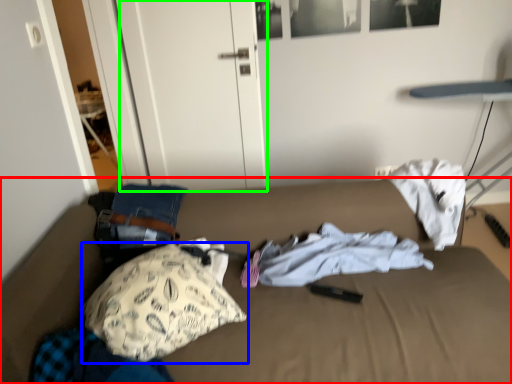
Question: Considering the real-world distances, which object is closest to bed (highlighted by a red box)? pillow (highlighted by a blue box) or door (highlighted by a green box).

Choices:
 (A) pillow
 (B) door

Answer: (A)